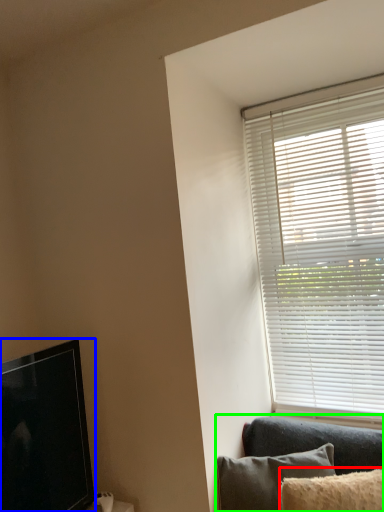
Question: Based on their relative distances, which object is farther from pillow (highlighted by a red box)? Choose from television (highlighted by a blue box) and studio couch (highlighted by a green box).

Choices:
 (A) television
 (B) studio couch

Answer: (A)